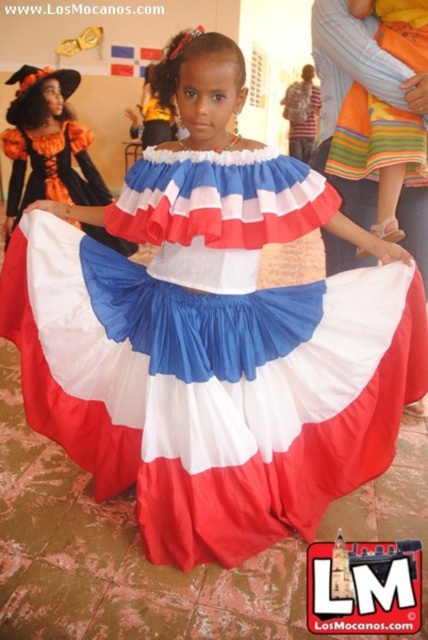
You are standing in front of the image and want to know how far the point at coordinates (x=385, y=132) is from your viewpoint. Can you determine the distance?

The point at coordinates (x=385, y=132) is 7.15 feet away from the camera, so it is 7.15 feet away from your viewpoint.

You are taking a photo of the scene and want to focus on both the point at coordinates point (410, 61) and point (53, 161). Which point should you focus on first to ensure both are in focus?

You should focus on point (410, 61) first because it is closer to the camera than point (53, 161), allowing both points to be in focus when using depth of field.

You are a photographer at a cultural festival and want to capture both the striped cotton dress at center and the matte fabric dress at center in the same frame. Which dress should you position closer to the left side of the camera frame to ensure both are visible?

The striped cotton dress at center is positioned on the right side of matte fabric dress at center, so to ensure both are visible, you should position the matte fabric dress at center closer to the left side of the camera frame.